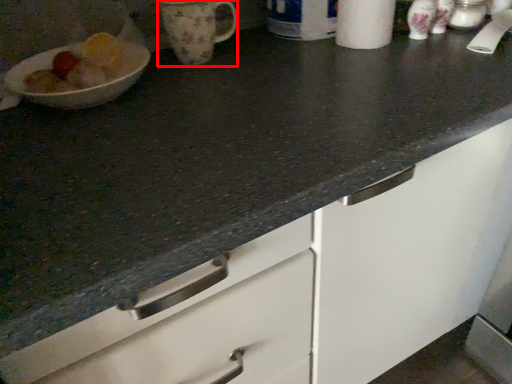
Question: In this image, where is mug (annotated by the red box) located relative to paper towel?

Choices:
 (A) right
 (B) left

Answer: (B)